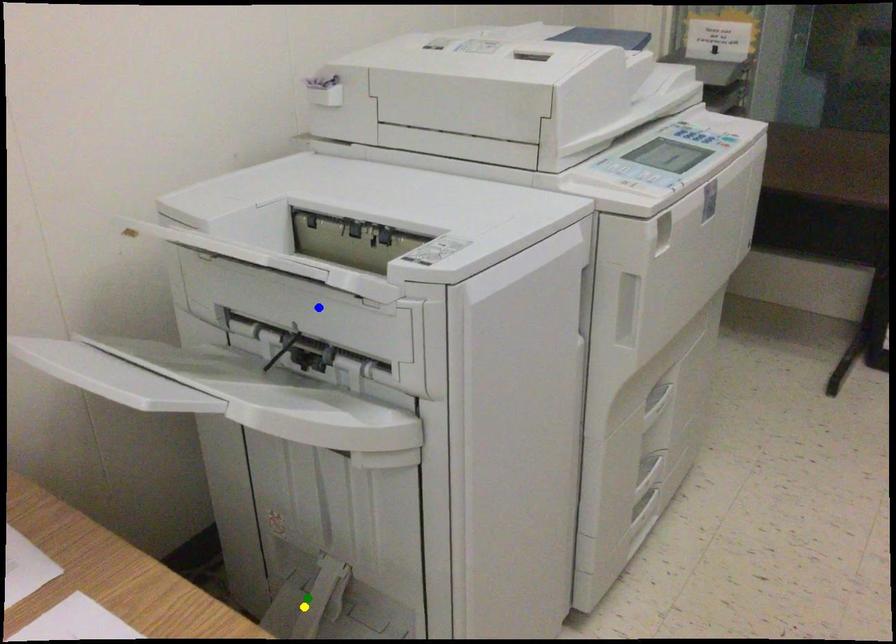
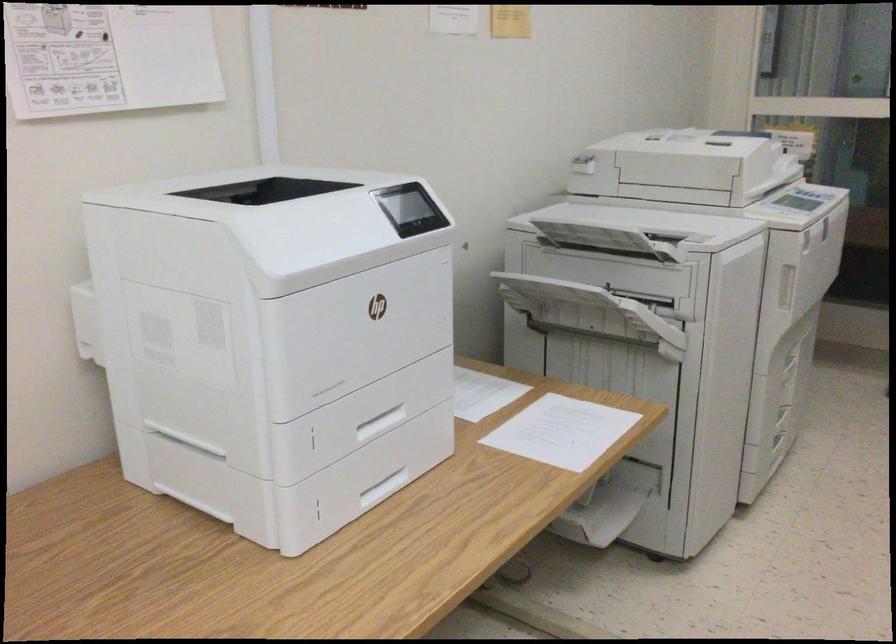
I am providing you with two images of the same scene from different viewpoints. Three points are marked in image1. Which point corresponds to a part or object that is occluded in image2?In image1, three points are marked. Which of them correspond to a part or object that is occluded in image2?Among the three points shown in image1, which one corresponds to a part or object that is no longer visible due to occlusion in image2?

Invisible in image2: yellow point, green point.